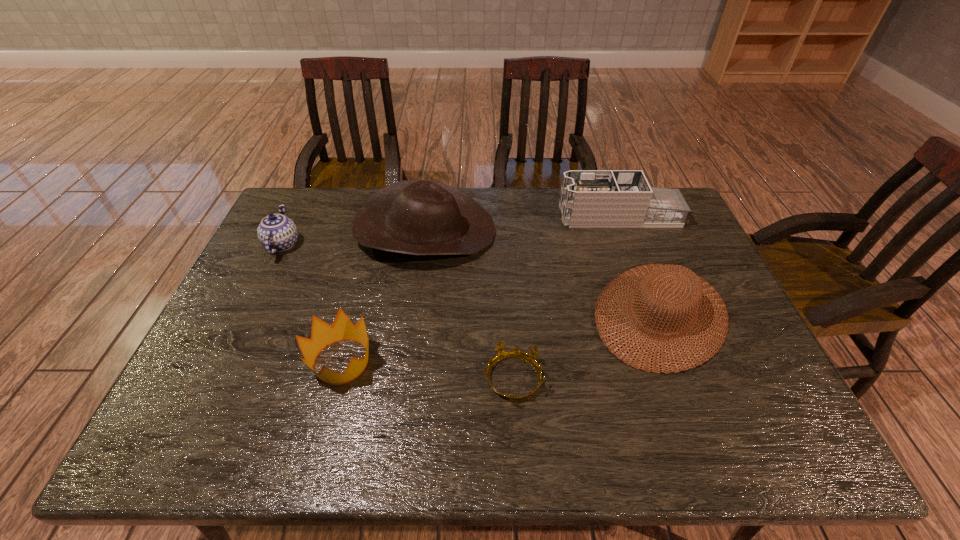
Image resolution: width=960 pixels, height=540 pixels. What are the coordinates of `free region located 0.320m at the entrance of the dollhouse` in the screenshot? It's located at (468, 216).

Where is `vacant space situated 0.180m at the spout of the chinaware`? vacant space situated 0.180m at the spout of the chinaware is located at coordinates (357, 245).

The height and width of the screenshot is (540, 960). In order to click on free location located 0.290m on the back of the sunhat in this screenshot , I will do `click(621, 209)`.

Where is `vacant area situated 0.050m on the back of the left crown`? vacant area situated 0.050m on the back of the left crown is located at coordinates (352, 320).

Where is `free region located 0.070m on the left of the shortest object`? free region located 0.070m on the left of the shortest object is located at coordinates (453, 379).

The image size is (960, 540). Identify the location of cowboy hat located in the far edge section of the desktop. (418, 217).

You are a GUI agent. You are given a task and a screenshot of the screen. Output one action in this format:
    pyautogui.click(x=<x>, y=<y>)
    Task: Click on the dollhouse at the far edge
    This screenshot has width=960, height=540.
    Given the screenshot: What is the action you would take?
    pyautogui.click(x=589, y=198)

Where is `chinaware present at the far edge`? Image resolution: width=960 pixels, height=540 pixels. chinaware present at the far edge is located at coordinates (276, 232).

You are a GUI agent. You are given a task and a screenshot of the screen. Output one action in this format:
    pyautogui.click(x=<x>, y=<y>)
    Task: Click on the object at the left edge
    This screenshot has width=960, height=540.
    Given the screenshot: What is the action you would take?
    pyautogui.click(x=276, y=232)

Where is `dollhouse located in the right edge section of the desktop`? The height and width of the screenshot is (540, 960). dollhouse located in the right edge section of the desktop is located at coordinates (589, 198).